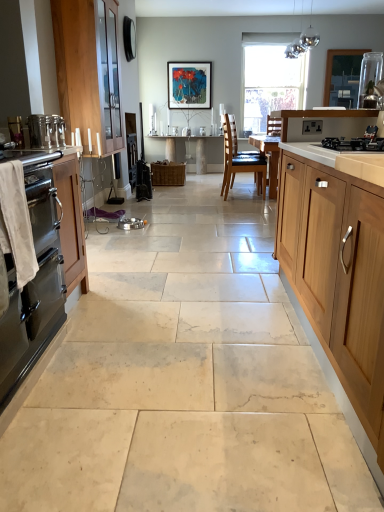
Question: Is satin silver toaster at left, which is the second appliance in top-to-bottom order, turned away from matte wooden picture frame at center?

Choices:
 (A) no
 (B) yes

Answer: (A)

Question: Is satin silver toaster at left, marked as the 2th appliance in a right-to-left arrangement, far away from matte wooden picture frame at center?

Choices:
 (A) yes
 (B) no

Answer: (A)

Question: From a real-world perspective, is satin silver toaster at left, the second appliance positioned from the bottom, located beneath matte wooden picture frame at center?

Choices:
 (A) no
 (B) yes

Answer: (B)

Question: Can you confirm if satin silver toaster at left, which appears as the first appliance when viewed from the front, is taller than matte wooden picture frame at center?

Choices:
 (A) no
 (B) yes

Answer: (A)

Question: Is satin silver toaster at left, which is the second appliance in top-to-bottom order, closer to the viewer compared to matte wooden picture frame at center?

Choices:
 (A) yes
 (B) no

Answer: (A)

Question: From a real-world perspective, is satin silver toaster at left, the second appliance positioned from the bottom, over matte wooden picture frame at center?

Choices:
 (A) yes
 (B) no

Answer: (B)

Question: Can you confirm if white marble table at center is shorter than transparent glass window at center?

Choices:
 (A) no
 (B) yes

Answer: (B)

Question: Could you tell me if white marble table at center is facing transparent glass window at center?

Choices:
 (A) yes
 (B) no

Answer: (B)

Question: Can you confirm if white marble table at center is positioned to the right of transparent glass window at center?

Choices:
 (A) yes
 (B) no

Answer: (B)

Question: Considering the relative sizes of white marble table at center and transparent glass window at center in the image provided, is white marble table at center wider than transparent glass window at center?

Choices:
 (A) yes
 (B) no

Answer: (A)

Question: Does white marble table at center have a larger size compared to transparent glass window at center?

Choices:
 (A) no
 (B) yes

Answer: (B)

Question: Considering the relative sizes of white marble table at center and transparent glass window at center in the image provided, is white marble table at center thinner than transparent glass window at center?

Choices:
 (A) no
 (B) yes

Answer: (A)

Question: From a real-world perspective, does wooden cabinet at left, the first cabinetry from the left, sit lower than satin silver toaster at left, marked as the 2th appliance in a right-to-left arrangement?

Choices:
 (A) yes
 (B) no

Answer: (B)